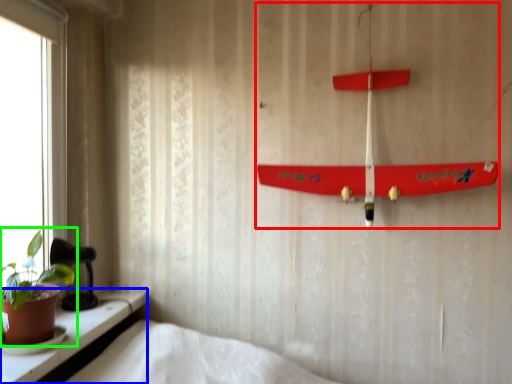
Question: Considering the real-world distances, which object is farthest from toy (highlighted by a red box)? window (highlighted by a blue box) or houseplant (highlighted by a green box)?

Choices:
 (A) window
 (B) houseplant

Answer: (B)